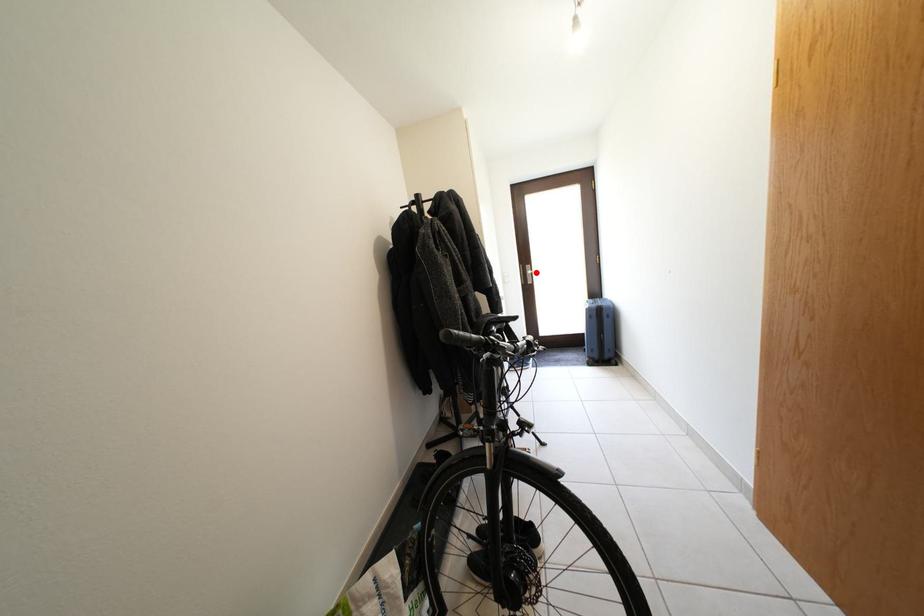
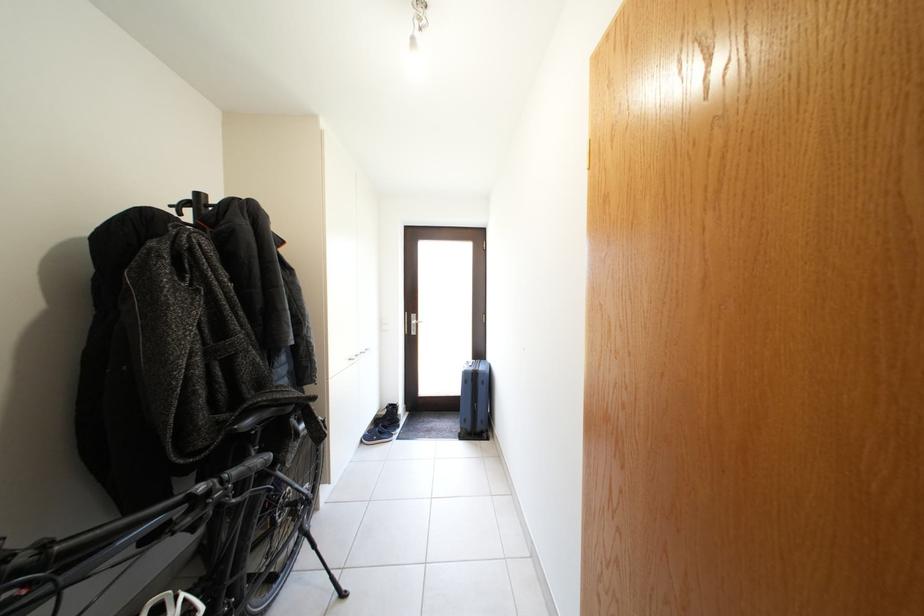
The point at the highlighted location is marked in the first image. Where is the corresponding point in the second image?

(421, 322)